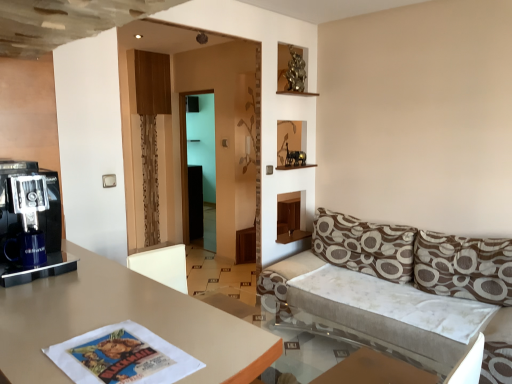
Question: Does brown printed cushion at right, arranged as the first pillow when viewed from the left, appear on the right side of brown textured pillow at right, the 1th pillow when ordered from right to left?

Choices:
 (A) yes
 (B) no

Answer: (B)

Question: Can you see brown printed cushion at right, placed as the 2th pillow when sorted from right to left, touching brown textured pillow at right, the 2th pillow in the left-to-right sequence?

Choices:
 (A) yes
 (B) no

Answer: (B)

Question: Is brown printed cushion at right, arranged as the first pillow when viewed from the left, smaller than brown textured pillow at right, the 2th pillow in the left-to-right sequence?

Choices:
 (A) yes
 (B) no

Answer: (B)

Question: From the image's perspective, is brown printed cushion at right, placed as the 2th pillow when sorted from right to left, on brown textured pillow at right, the 1th pillow when ordered from right to left?

Choices:
 (A) no
 (B) yes

Answer: (B)

Question: Is brown printed cushion at right, placed as the 2th pillow when sorted from right to left, bigger than brown textured pillow at right, the 1th pillow when ordered from right to left?

Choices:
 (A) yes
 (B) no

Answer: (A)

Question: Can brown textured pillow at right, the 2th pillow in the left-to-right sequence, be found inside brown printed cushion at right, arranged as the first pillow when viewed from the left?

Choices:
 (A) yes
 (B) no

Answer: (B)

Question: From the image's perspective, is matte black coffee machine at left over transparent glass door at center?

Choices:
 (A) yes
 (B) no

Answer: (B)

Question: Could you tell me if matte black coffee machine at left is facing transparent glass door at center?

Choices:
 (A) no
 (B) yes

Answer: (A)

Question: Can you confirm if matte black coffee machine at left is smaller than transparent glass door at center?

Choices:
 (A) yes
 (B) no

Answer: (A)

Question: Would you say matte black coffee machine at left is a long distance from transparent glass door at center?

Choices:
 (A) no
 (B) yes

Answer: (B)

Question: Does matte black coffee machine at left have a larger size compared to transparent glass door at center?

Choices:
 (A) no
 (B) yes

Answer: (A)

Question: From the image's perspective, is matte black coffee machine at left beneath transparent glass door at center?

Choices:
 (A) no
 (B) yes

Answer: (B)

Question: Considering the relative sizes of brown textured pillow at right, the 1th pillow when ordered from right to left, and matte beige table at center in the image provided, is brown textured pillow at right, the 1th pillow when ordered from right to left, shorter than matte beige table at center?

Choices:
 (A) no
 (B) yes

Answer: (B)